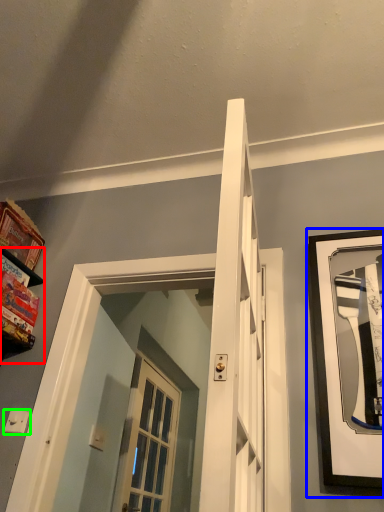
Question: Which object is positioned closest to shelf (highlighted by a red box)? Select from picture frame (highlighted by a blue box) and light switch (highlighted by a green box).

Choices:
 (A) picture frame
 (B) light switch

Answer: (B)